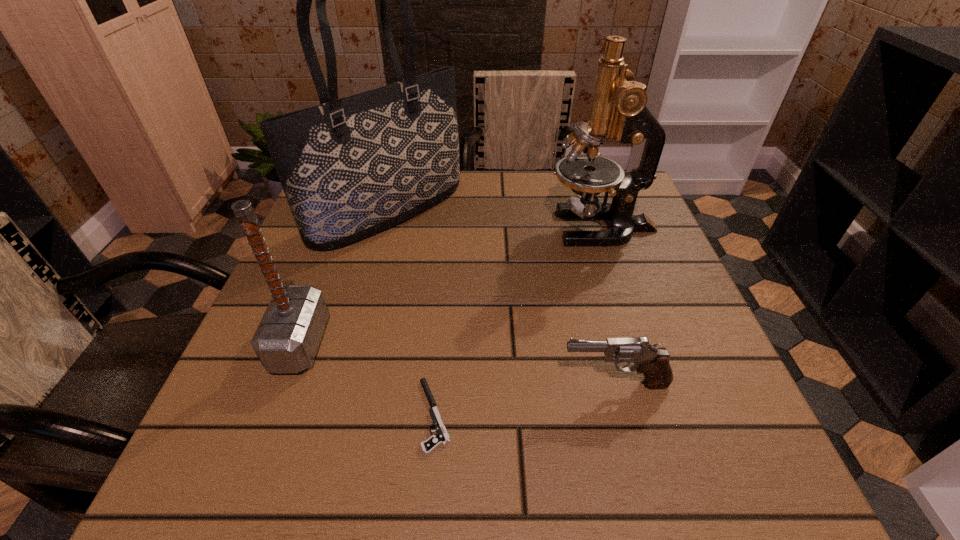
Find the location of a particular element. This screenshot has height=540, width=960. object at the near edge is located at coordinates (441, 437).

Locate an element on the screen. Image resolution: width=960 pixels, height=540 pixels. tote bag present at the left edge is located at coordinates (352, 167).

You are a GUI agent. You are given a task and a screenshot of the screen. Output one action in this format:
    pyautogui.click(x=<x>, y=<y>)
    Task: Click on the hammer that is at the left edge
    The width and height of the screenshot is (960, 540).
    Given the screenshot: What is the action you would take?
    pyautogui.click(x=287, y=338)

The image size is (960, 540). In order to click on microscope located at the right edge in this screenshot , I will do `click(618, 109)`.

I want to click on pistol at the right edge, so click(x=653, y=362).

This screenshot has width=960, height=540. Identify the location of object that is at the far left corner. (352, 167).

In order to click on object present at the far right corner in this screenshot , I will do `click(618, 109)`.

At what (x,y) coordinates should I click in order to perform the action: click on free region at the far edge of the desktop. Please return your answer as a coordinate pair (x, y). The image size is (960, 540). Looking at the image, I should click on (548, 176).

Where is `vacant space at the near edge of the desktop`? vacant space at the near edge of the desktop is located at coordinates (625, 478).

Locate an element on the screen. The width and height of the screenshot is (960, 540). free space at the left edge of the desktop is located at coordinates (289, 259).